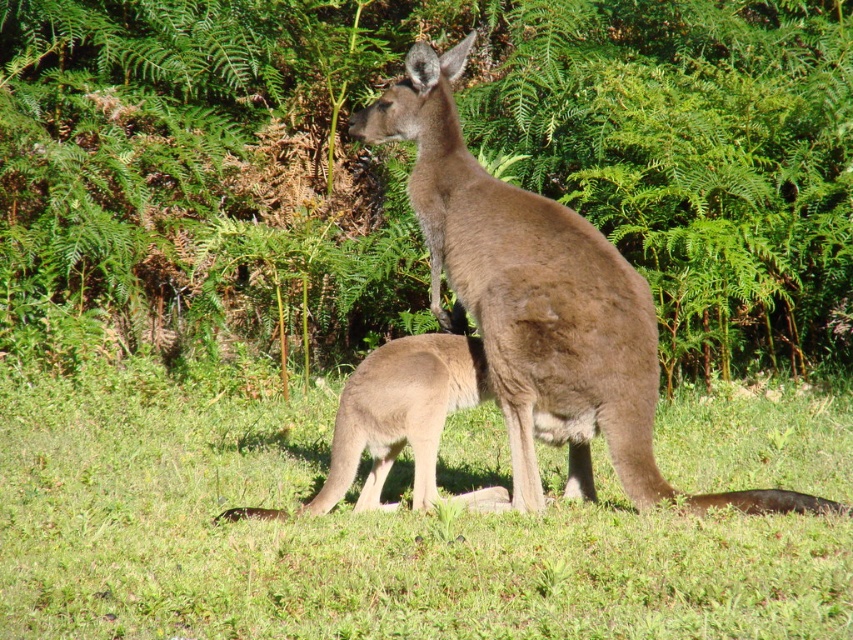
Based on the photo, is green leafy foliage at center below brown furry kangaroo at center?

No, green leafy foliage at center is not below brown furry kangaroo at center.

Can you confirm if green leafy foliage at center is positioned to the left of brown furry kangaroo at center?

Incorrect, green leafy foliage at center is not on the left side of brown furry kangaroo at center.

What do you see at coordinates (409, 168) in the screenshot? I see `green leafy foliage at center` at bounding box center [409, 168].

This screenshot has height=640, width=853. What are the coordinates of `green leafy foliage at center` in the screenshot? It's located at (409, 168).

Which is below, green grassy at center or brown furry kangaroo at center?

green grassy at center is lower down.

Where is `green grassy at center`? Image resolution: width=853 pixels, height=640 pixels. green grassy at center is located at coordinates [352, 538].

In order to click on green leafy foliage at center in this screenshot , I will do `click(409, 168)`.

Is green leafy foliage at center to the right of green grassy at center from the viewer's perspective?

Yes, green leafy foliage at center is to the right of green grassy at center.

Identify the location of green leafy foliage at center. point(409,168).

Locate an element on the screen. green leafy foliage at center is located at coordinates (409, 168).